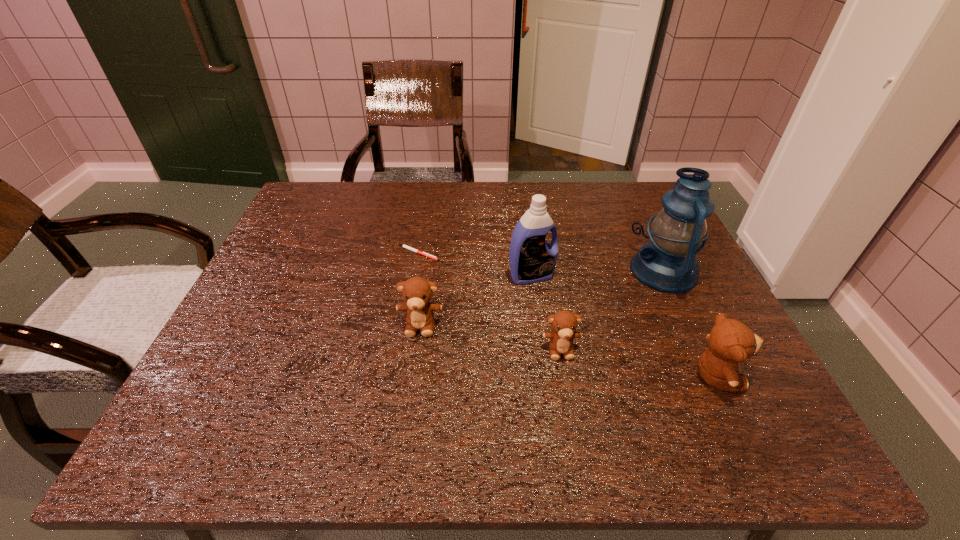
Identify the location of free space that satisfies the following two spatial constraints: 1. on the face of the lantern; 2. on the front side of the fifth shortest object. (666, 275).